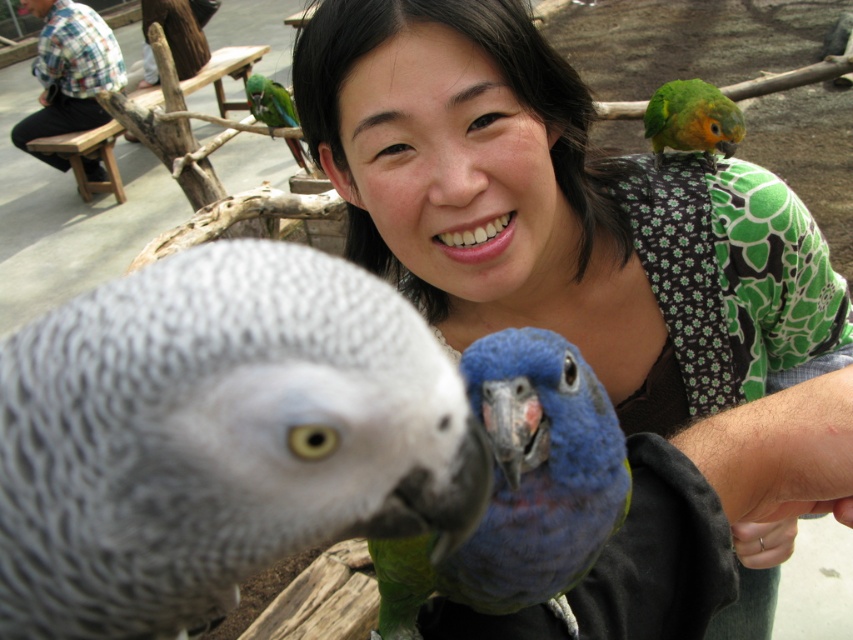
You are a bird trainer and need to determine if the green matte parrot at upper right can fit through a circular opening in a cage that is the same size as the silver metallic ring on the right. Based on their widths, can the parrot pass through the opening?

The green matte parrot at upper right might be wider than the silver metallic ring on the right, so there is a possibility that it cannot pass through the opening safely.